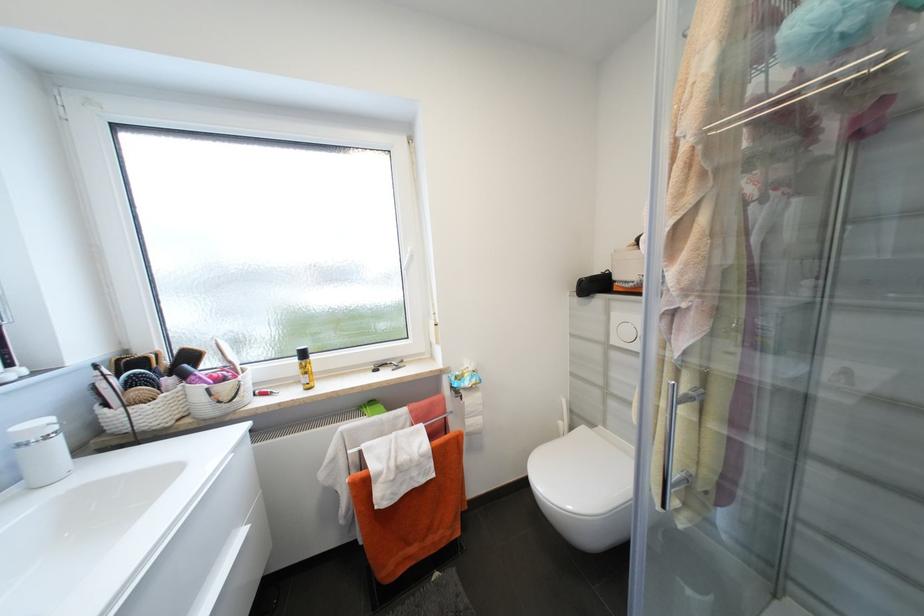
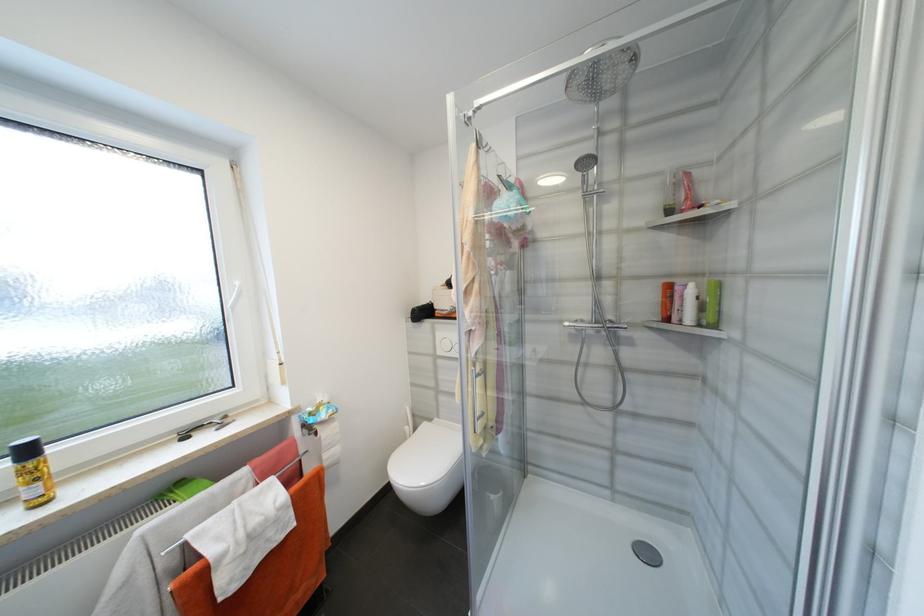
The point at (310, 355) is marked in the first image. Where is the corresponding point in the second image?

(33, 453)